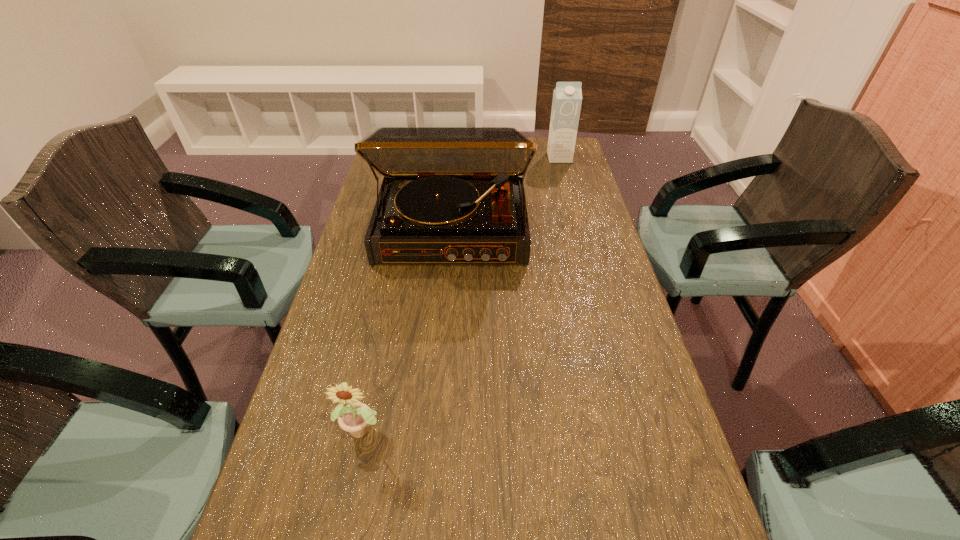
The height and width of the screenshot is (540, 960). I want to click on the tallest object, so click(x=450, y=195).

Locate an element on the screen. The image size is (960, 540). record player is located at coordinates (450, 195).

Where is `the rightmost object`? This screenshot has width=960, height=540. the rightmost object is located at coordinates (567, 96).

At what (x,y) coordinates should I click in order to perform the action: click on the second tallest object. Please return your answer as a coordinate pair (x, y). The width and height of the screenshot is (960, 540). Looking at the image, I should click on (567, 96).

Locate an element on the screen. This screenshot has width=960, height=540. the nearest object is located at coordinates (354, 418).

In order to click on the shortest object in this screenshot , I will do `click(354, 418)`.

Find the location of a particular element. The height and width of the screenshot is (540, 960). vacant region located on the front-facing side of the second nearest object is located at coordinates (443, 349).

In order to click on free region located on the front label of the second tallest object in this screenshot , I will do `click(570, 197)`.

Identify the location of vacant region located on the front-facing side of the shortest object. (352, 481).

Image resolution: width=960 pixels, height=540 pixels. I want to click on object positioned at the far edge, so click(567, 96).